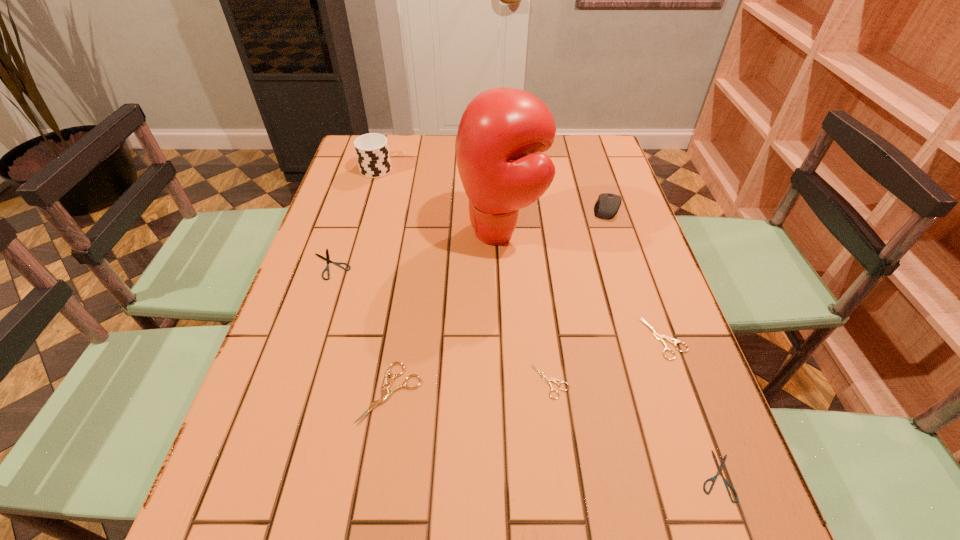
I want to click on shears that is the third closest one to the second biggest beige shears, so click(386, 394).

Where is `beige shears that can be found as the second closest to the smallest beige shears`? The height and width of the screenshot is (540, 960). beige shears that can be found as the second closest to the smallest beige shears is located at coordinates pos(386,394).

Identify which beige shears is the third closest to the cup. Please provide its 2D coordinates. Your answer should be formatted as a tuple, i.e. [(x, y)], where the tuple contains the x and y coordinates of a point satisfying the conditions above.

[(661, 338)]

You are a GUI agent. You are given a task and a screenshot of the screen. Output one action in this format:
    pyautogui.click(x=<x>, y=<y>)
    Task: Click on the vacant area that satisfies the following two spatial constraints: 1. on the striking surface of the tallest object; 2. on the right side of the smallest beige shears
    The image size is (960, 540).
    Given the screenshot: What is the action you would take?
    pyautogui.click(x=509, y=381)

Where is `vacant space that satisfies the following two spatial constraints: 1. on the striking surface of the red boxing glove; 2. on the left side of the rightmost beige shears`? This screenshot has height=540, width=960. vacant space that satisfies the following two spatial constraints: 1. on the striking surface of the red boxing glove; 2. on the left side of the rightmost beige shears is located at coordinates (507, 338).

Where is `vacant space that satisfies the following two spatial constraints: 1. on the front side of the right black shears; 2. on the left side of the smallest beige shears`? This screenshot has height=540, width=960. vacant space that satisfies the following two spatial constraints: 1. on the front side of the right black shears; 2. on the left side of the smallest beige shears is located at coordinates (562, 475).

Find the location of `free space that satisfies the following two spatial constraints: 1. on the striking surface of the boxing glove; 2. on the back side of the nearest shears`. free space that satisfies the following two spatial constraints: 1. on the striking surface of the boxing glove; 2. on the back side of the nearest shears is located at coordinates coord(514,475).